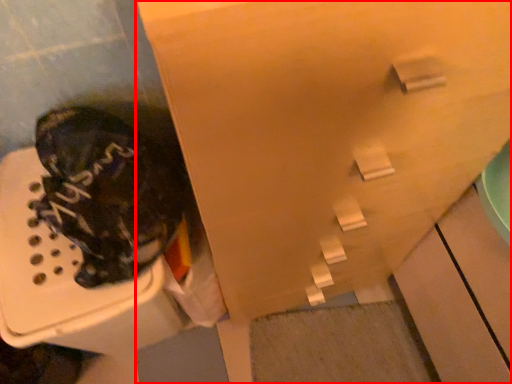
Question: From the image's perspective, considering the relative positions of cabinetry (annotated by the red box) and footwear in the image provided, where is cabinetry (annotated by the red box) located with respect to the staircase?

Choices:
 (A) above
 (B) below

Answer: (A)